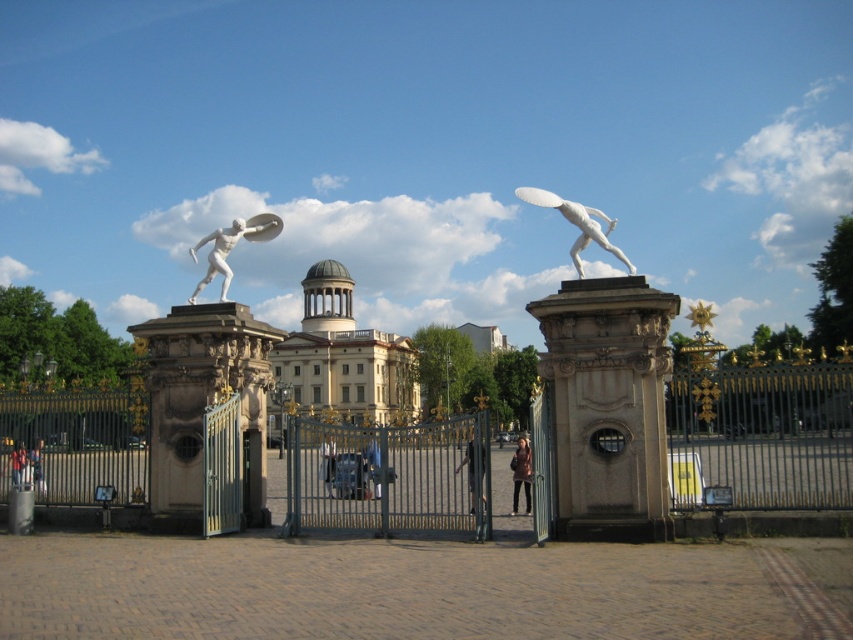
Question: Which point is farther to the camera?

Choices:
 (A) white marble building at center
 (B) dark brown leather jacket at center
 (C) matte black person at lower left

Answer: (C)

Question: Which object is the farthest from the white marble discus thrower at left?

Choices:
 (A) matte pink coat at center
 (B) white glossy statue at upper right
 (C) dark brown leather jacket at lower left
 (D) matte gray statue at center

Answer: (B)

Question: Is dark brown leather jacket at center wider than matte black person at lower left?

Choices:
 (A) yes
 (B) no

Answer: (B)

Question: Which point is closer to the camera?

Choices:
 (A) (328, 435)
 (B) (41, 477)

Answer: (A)

Question: Can you confirm if metallic/golden gate at center is positioned above white marble discus thrower at left?

Choices:
 (A) yes
 (B) no

Answer: (B)

Question: Can you confirm if metallic/golden gate at center is smaller than white glossy statue at upper right?

Choices:
 (A) no
 (B) yes

Answer: (B)